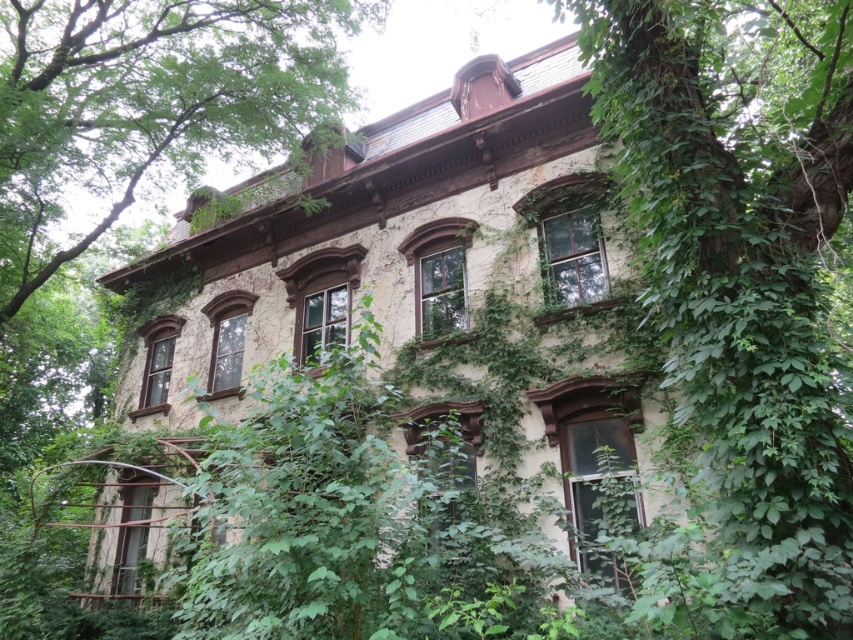
You are standing in front of the house and notice the green leafy vine at center and the green leafy tree at upper center. Which object is closer to the ground?

The green leafy vine at center is positioned under the green leafy tree at upper center, so the vine is closer to the ground than the tree.

From the picture: You are a painter standing in front of the house and want to paint the green leafy vine at center and the green leafy tree at upper center. Which object is closer to you?

The green leafy vine at center is closer to you because it is in front of the green leafy tree at upper center.

You are standing in front of the house and notice two green leafy plants. One is the green leafy vine at center and the other is the green leafy tree at upper center. Which one is positioned to the right of the other?

The green leafy vine at center is positioned to the right of the green leafy tree at upper center.